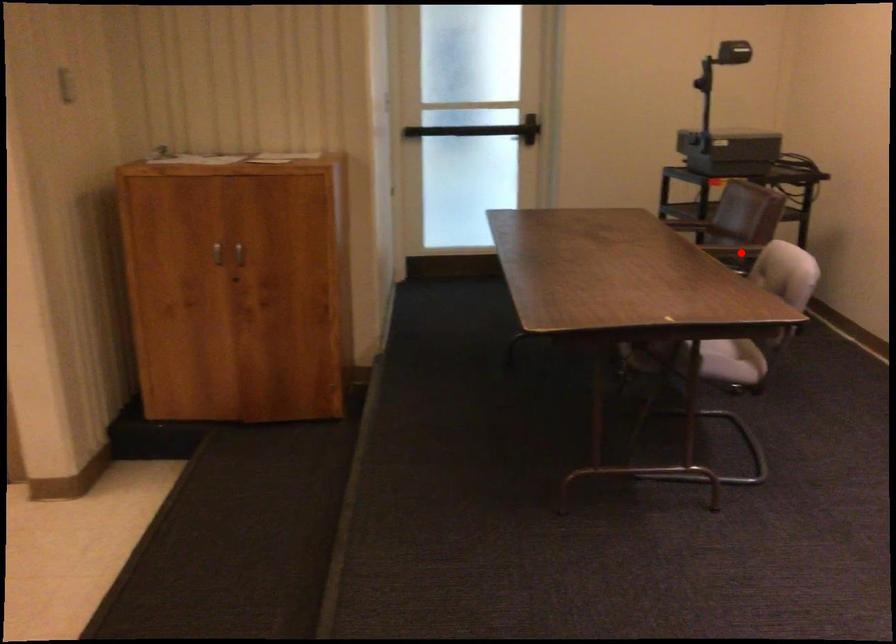
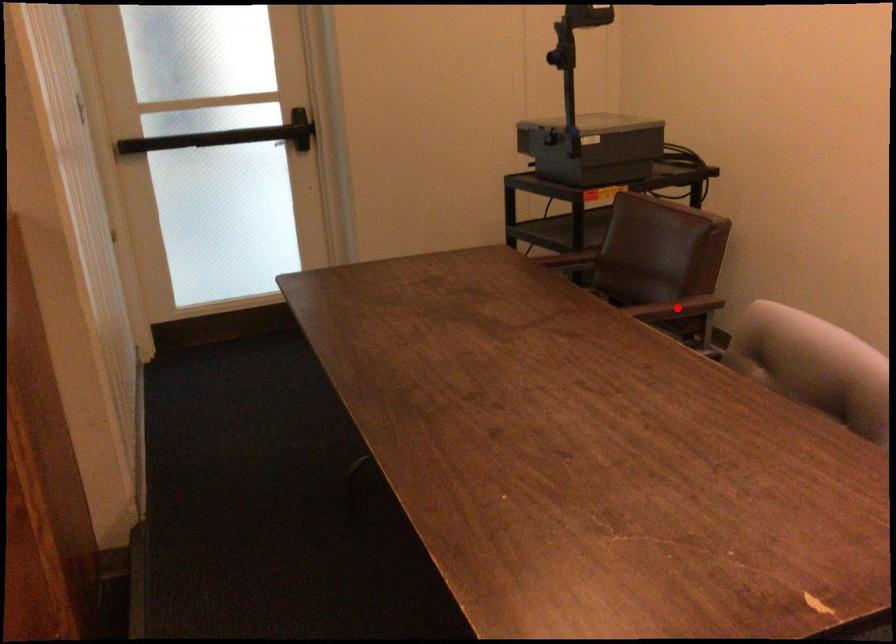
I am providing you with two images of the same scene from different viewpoints. A red point is marked on the first image and another point is marked on the second image. Are the points marked in image1 and image2 representing the same 3D position?

Yes